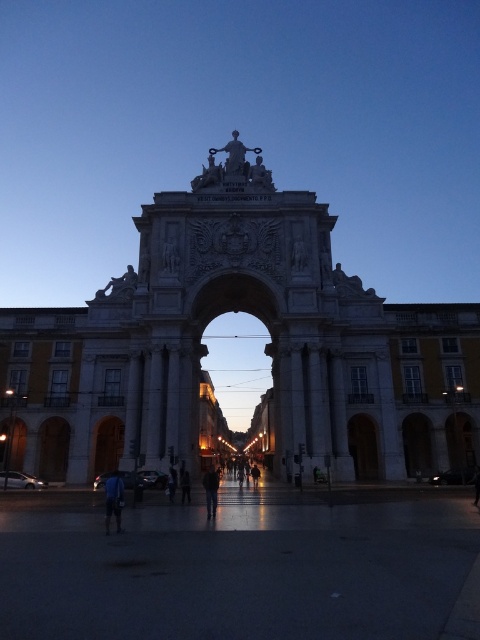
You are an event organizer setting up a photo shoot at the Rua Augusta Arch. You have two fabrics, the blue fabric at lower left and the dark blue fabric at center. Which fabric is covering the other one?

The blue fabric at lower left is positioned over the dark blue fabric at center, so the blue fabric at lower left is covering the dark blue fabric at center.

You are an event organizer setting up a photo shoot at the Rua Augusta Arch. You have two blue fabrics to place near the archway. The blue fabric at lower left and the dark blue fabric at center. Which fabric should you choose if you need a wider one to cover a large backdrop?

The blue fabric at lower left is wider than the dark blue fabric at center, so you should choose the blue fabric at lower left to cover a large backdrop.